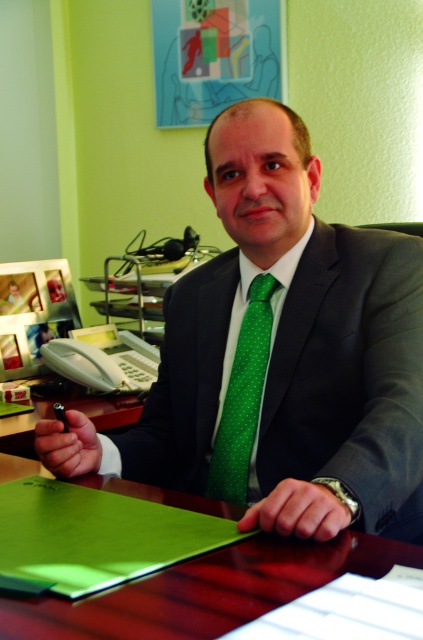
You are an interior designer planning to place a decorative item on the wooden table at center and the green dotted tie at center. Which surface can accommodate a wider object?

The wooden table at center is wider than the green dotted tie at center, so it can accommodate a wider object.